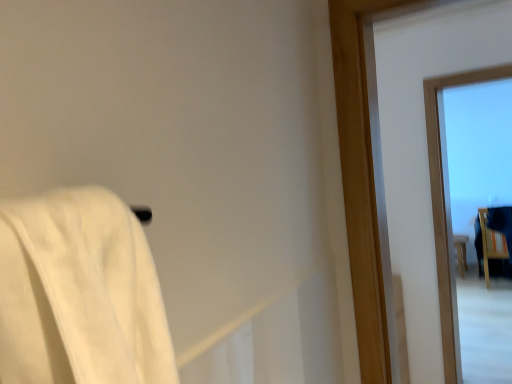
Question: In terms of height, does wooden chair at right, marked as the first furniture in a front-to-back arrangement, look taller or shorter compared to wooden stool at right, which is the 1th furniture in back-to-front order?

Choices:
 (A) tall
 (B) short

Answer: (A)

Question: Is wooden chair at right, which is the second furniture from back to front, bigger or smaller than wooden stool at right, placed as the second furniture when sorted from front to back?

Choices:
 (A) small
 (B) big

Answer: (B)

Question: Which of these objects is positioned farthest from the wooden stool at right, which is the 1th furniture in back-to-front order?

Choices:
 (A) transparent glass window at upper right
 (B) wooden chair at right, marked as the first furniture in a front-to-back arrangement

Answer: (A)

Question: Considering the real-world distances, which object is closest to the wooden chair at right, which is the second furniture from back to front?

Choices:
 (A) transparent glass window at upper right
 (B) wooden stool at right, which is the 1th furniture in back-to-front order

Answer: (B)